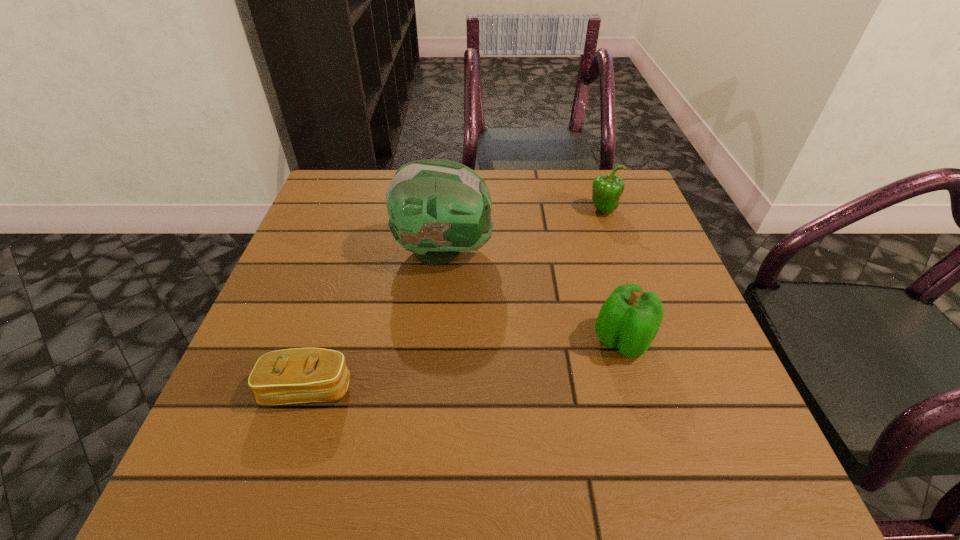
The image size is (960, 540). I want to click on object that is at the far edge, so pyautogui.click(x=606, y=189).

Identify the location of object situated at the left edge. Image resolution: width=960 pixels, height=540 pixels. (299, 375).

At what (x,y) coordinates should I click in order to perform the action: click on object that is at the far right corner. Please return your answer as a coordinate pair (x, y). The height and width of the screenshot is (540, 960). Looking at the image, I should click on (606, 189).

Find the location of a particular element. blank area at the far edge is located at coordinates (523, 206).

Locate an element on the screen. The height and width of the screenshot is (540, 960). free space at the near edge is located at coordinates (655, 462).

The height and width of the screenshot is (540, 960). What are the coordinates of `vacant region at the left edge of the desktop` in the screenshot? It's located at (x=324, y=342).

In order to click on vacant space at the right edge of the desktop in this screenshot , I will do `click(636, 371)`.

You are a GUI agent. You are given a task and a screenshot of the screen. Output one action in this format:
    pyautogui.click(x=<x>, y=<y>)
    Task: Click on the vacant space at the far left corner of the desktop
    The height and width of the screenshot is (540, 960).
    Given the screenshot: What is the action you would take?
    pos(379,186)

At what (x,y) coordinates should I click in order to perform the action: click on vacant region at the near left corner of the desktop. Please return your answer as a coordinate pair (x, y). Image resolution: width=960 pixels, height=540 pixels. Looking at the image, I should click on (207, 460).

The image size is (960, 540). Find the location of `vacant space at the far right corner of the desktop`. vacant space at the far right corner of the desktop is located at coordinates (625, 196).